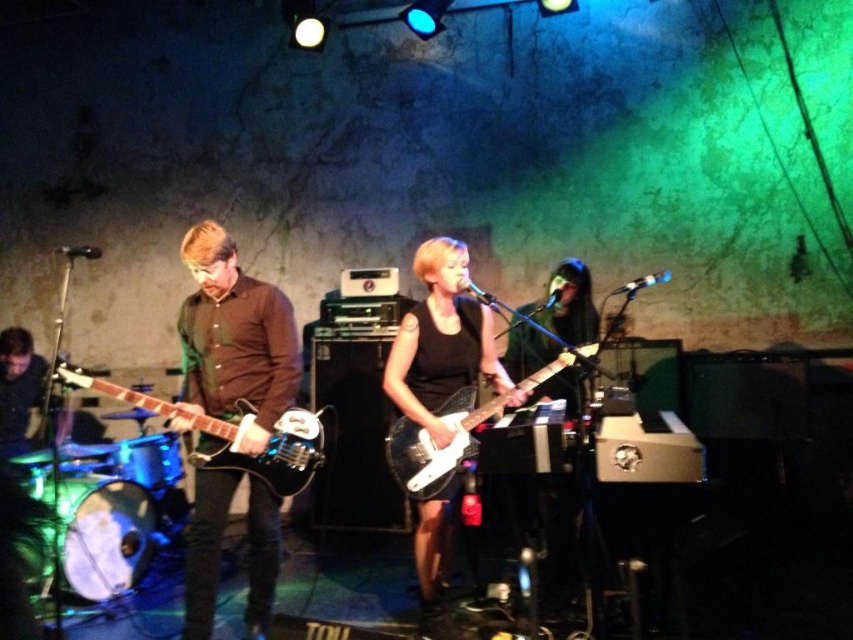
In the scene shown: You are a photographer trying to capture the best shot of the stage. You notice two points marked on the stage at coordinates point [422,308] and point [167,401]. Which point is closer to your camera position?

Point [422,308] is closer to the camera than point [167,401].

Looking at this image, you are a stagehand setting up a music video shoot. You need to place a 1.2 meter tall amplifier between the black matte guitar at center and the glossy black electric guitar at left. Will the amplifier fit vertically between them based on their heights?

The black matte guitar at center is taller than the glossy black electric guitar at left. Since the amplifier is 1.2 meters tall, it can only fit vertically if the space between the guitars accommodates this height. However, the description only provides information about their relative heights, not the distance between them. Therefore, we cannot determine if the amplifier will fit based solely on the given information.

Looking at this image, you are a photographer in the audience at this live music performance. You want to capture a clear photo of the matte brown shirt at center without the black matte guitar at center blocking it. Is this possible given their current positions?

The matte brown shirt at center is positioned over the black matte guitar at center, so the shirt is in front of the guitar. This means the photographer can capture a clear photo of the matte brown shirt at center without the guitar blocking it since the shirt is covering the guitar in this arrangement.